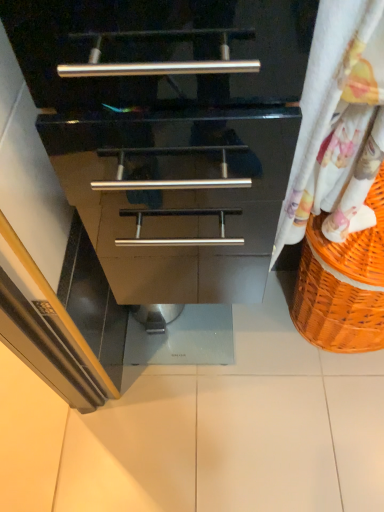
Question: Does white glossy tile at center touch white floral fabric at right?

Choices:
 (A) no
 (B) yes

Answer: (A)

Question: Does white glossy tile at center come in front of white floral fabric at right?

Choices:
 (A) no
 (B) yes

Answer: (A)

Question: Is white glossy tile at center completely or partially outside of white floral fabric at right?

Choices:
 (A) yes
 (B) no

Answer: (A)

Question: Can you confirm if white glossy tile at center is shorter than white floral fabric at right?

Choices:
 (A) no
 (B) yes

Answer: (B)

Question: Is white glossy tile at center surrounding white floral fabric at right?

Choices:
 (A) no
 (B) yes

Answer: (A)

Question: From the image's perspective, is white floral fabric at right located above or below orange woven basket at right?

Choices:
 (A) below
 (B) above

Answer: (B)

Question: Would you say white floral fabric at right is inside or outside orange woven basket at right?

Choices:
 (A) outside
 (B) inside

Answer: (A)

Question: Visually, is white floral fabric at right positioned to the left or to the right of orange woven basket at right?

Choices:
 (A) right
 (B) left

Answer: (B)

Question: From a real-world perspective, is white floral fabric at right positioned above or below orange woven basket at right?

Choices:
 (A) above
 (B) below

Answer: (A)

Question: Relative to orange woven basket at right, is white glossy tile at center in front or behind?

Choices:
 (A) front
 (B) behind

Answer: (B)

Question: Is white glossy tile at center situated inside orange woven basket at right or outside?

Choices:
 (A) outside
 (B) inside

Answer: (A)

Question: From their relative heights in the image, would you say white glossy tile at center is taller or shorter than orange woven basket at right?

Choices:
 (A) short
 (B) tall

Answer: (A)

Question: Considering the positions of point (130, 327) and point (377, 330), is point (130, 327) closer or farther from the camera than point (377, 330)?

Choices:
 (A) closer
 (B) farther

Answer: (B)

Question: In terms of width, does orange woven basket at right look wider or thinner when compared to white floral fabric at right?

Choices:
 (A) thin
 (B) wide

Answer: (B)

Question: Does point (354, 316) appear closer or farther from the camera than point (347, 140)?

Choices:
 (A) farther
 (B) closer

Answer: (A)